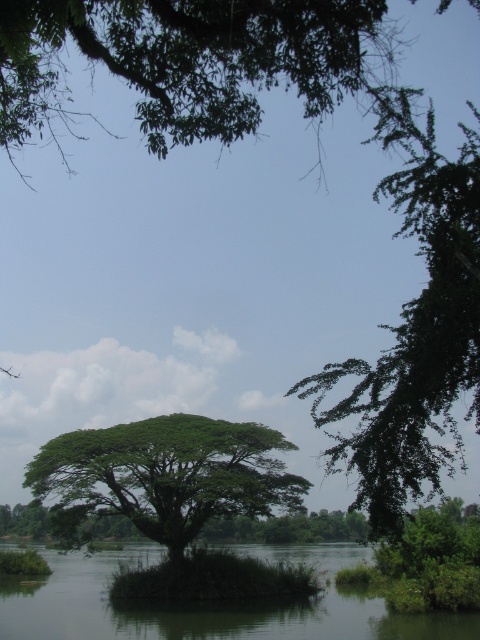
Which is more to the right, green leafy tree at upper center or green leafy lake at center?

From the viewer's perspective, green leafy tree at upper center appears more on the right side.

Does point (301, 6) lie behind point (41, 605)?

No.

In order to click on green leafy tree at upper center in this screenshot , I will do `click(192, 64)`.

Between green leafy tree at upper center and green leafy tree at center, which one appears on the right side from the viewer's perspective?

Positioned to the right is green leafy tree at center.

Does green leafy tree at upper center have a greater height compared to green leafy tree at center?

Correct, green leafy tree at upper center is much taller as green leafy tree at center.

What do you see at coordinates (192, 64) in the screenshot? I see `green leafy tree at upper center` at bounding box center [192, 64].

Where is `green leafy tree at upper center`? This screenshot has width=480, height=640. green leafy tree at upper center is located at coordinates (192, 64).

Between point (190, 420) and point (203, 634), which one is positioned behind?

Point (190, 420)

Can you confirm if green leafy tree at center is smaller than green leafy lake at center?

Yes, green leafy tree at center is smaller than green leafy lake at center.

Does point (222, 420) come in front of point (325, 602)?

No, it is not.

I want to click on green leafy tree at center, so click(x=164, y=476).